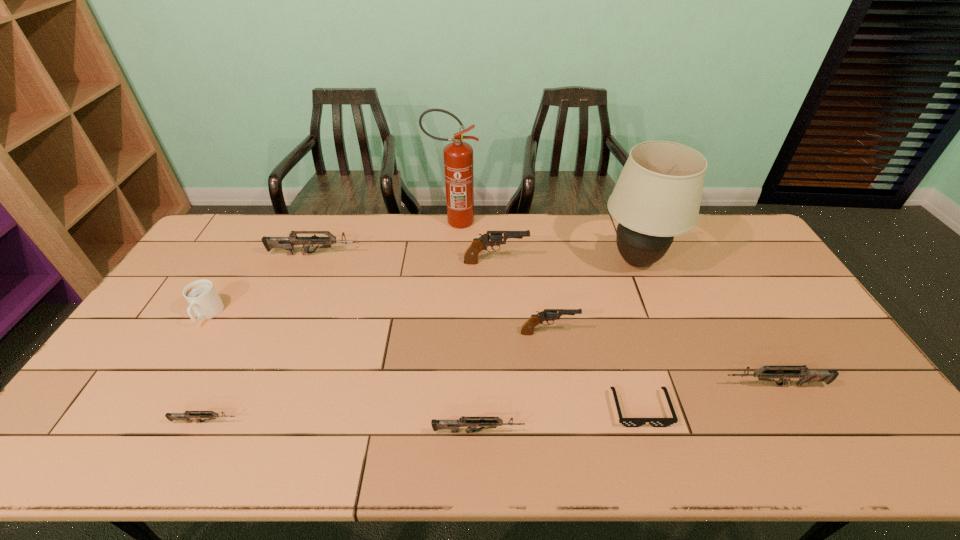
At what (x,y) coordinates should I click in order to perform the action: click on empty location between the smaller black gun and the second shortest object. Please return your answer as a coordinate pair (x, y). Image resolution: width=960 pixels, height=540 pixels. Looking at the image, I should click on (377, 377).

Where is `object that is the third nearest to the lampshade`? Image resolution: width=960 pixels, height=540 pixels. object that is the third nearest to the lampshade is located at coordinates (805, 376).

Identify which object is the third nearest to the leftmost object. Please provide its 2D coordinates. Your answer should be formatted as a tuple, i.e. [(x, y)], where the tuple contains the x and y coordinates of a point satisfying the conditions above.

[(458, 156)]

Identify which gun is the sixth nearest to the sixth nearest object. Please provide its 2D coordinates. Your answer should be formatted as a tuple, i.e. [(x, y)], where the tuple contains the x and y coordinates of a point satisfying the conditions above.

[(805, 376)]

This screenshot has width=960, height=540. In order to click on gun that is the fifth closest to the cappuccino in this screenshot , I will do `click(547, 315)`.

I want to click on the third closest grey gun to the third shortest object, so click(x=287, y=243).

Select which grey gun is the closest to the fourth tallest gun. Please provide its 2D coordinates. Your answer should be formatted as a tuple, i.e. [(x, y)], where the tuple contains the x and y coordinates of a point satisfying the conditions above.

[(483, 422)]

At what (x,y) coordinates should I click in order to perform the action: click on vacant point that satisfies the following two spatial constraints: 1. from the nozzle of the lampshade; 2. on the left side of the farthest object. Please return your answer as a coordinate pair (x, y). Image resolution: width=960 pixels, height=540 pixels. Looking at the image, I should click on (451, 261).

Find the location of `free space in the image that satisfies the following two spatial constraints: 1. from the nozzle of the farthest object; 2. on the side with the handle of the white cappuccino`. free space in the image that satisfies the following two spatial constraints: 1. from the nozzle of the farthest object; 2. on the side with the handle of the white cappuccino is located at coordinates (446, 315).